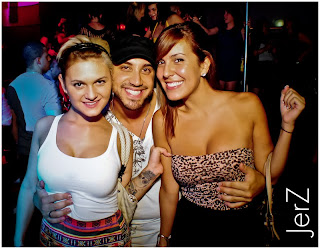
What are the coordinates of `tv monitor screen in background` in the screenshot? It's located at (29, 15).